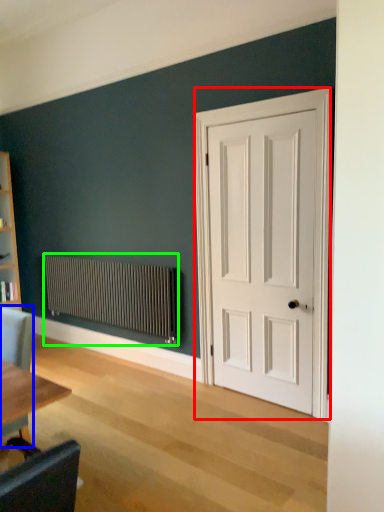
Question: Which object is the closest to the door (highlighted by a red box)? Choose among these: chair (highlighted by a blue box) or radiator (highlighted by a green box).

Choices:
 (A) chair
 (B) radiator

Answer: (B)